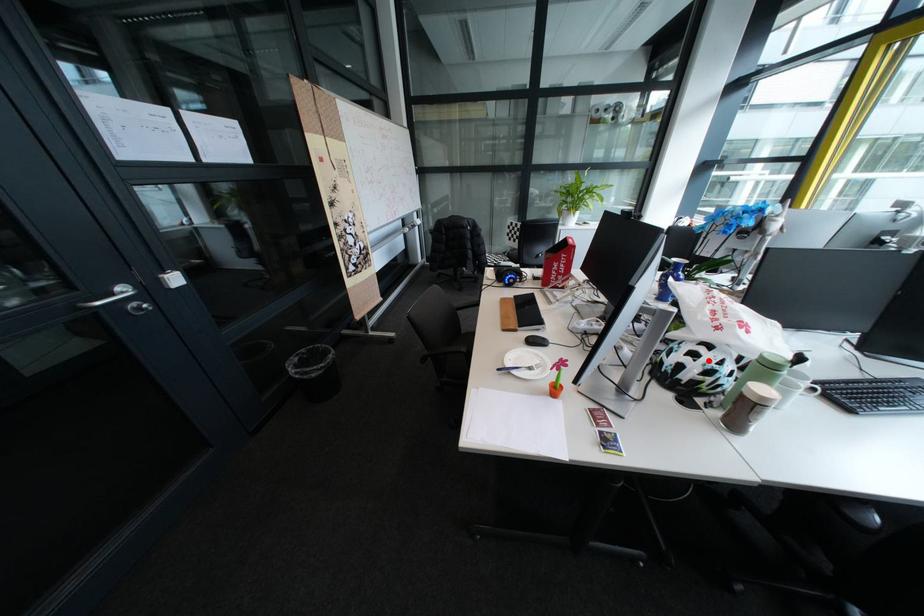
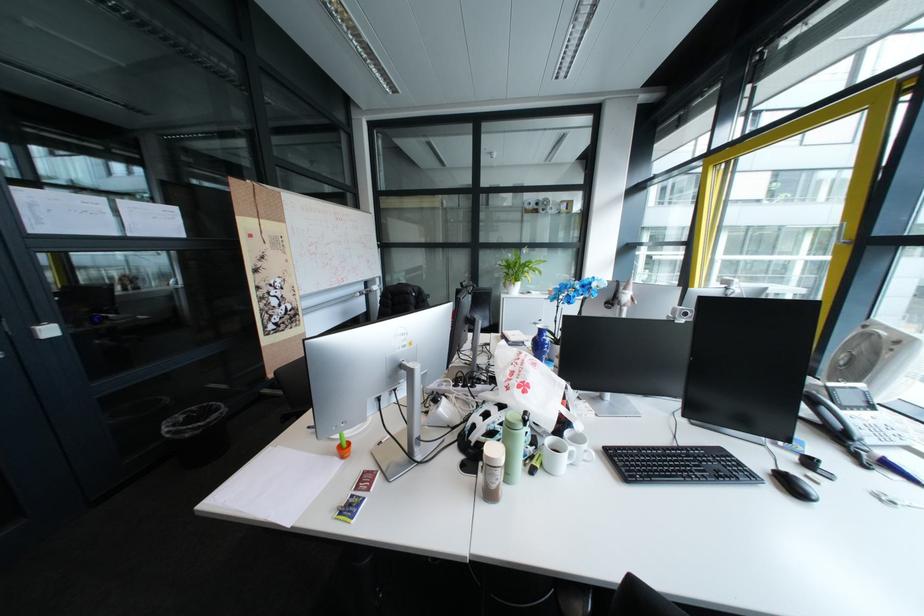
The point at the highlighted location is marked in the first image. Where is the corresponding point in the second image?

(497, 421)